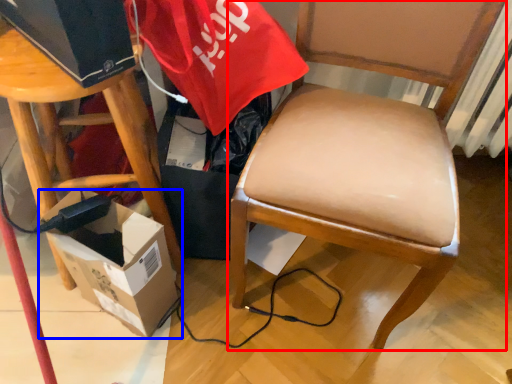
Question: Which point is further to the camera, chair (highlighted by a red box) or box (highlighted by a blue box)?

Choices:
 (A) chair
 (B) box

Answer: (B)